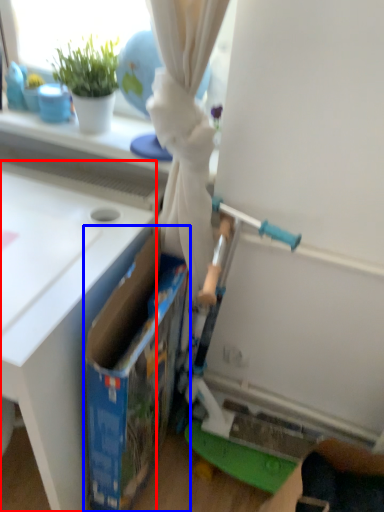
Question: Which object appears closest to the camera in this image, table (highlighted by a red box) or storage box (highlighted by a blue box)?

Choices:
 (A) table
 (B) storage box

Answer: (A)